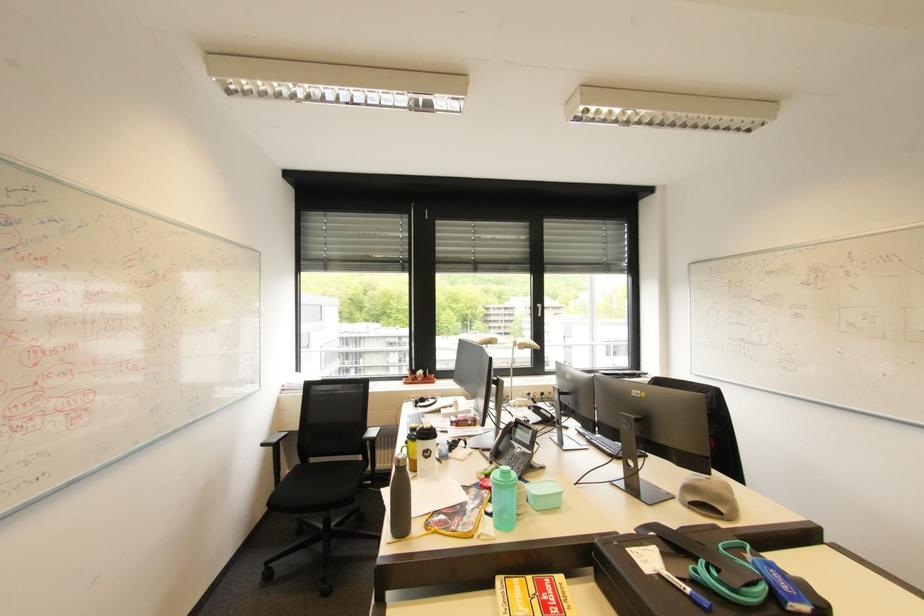
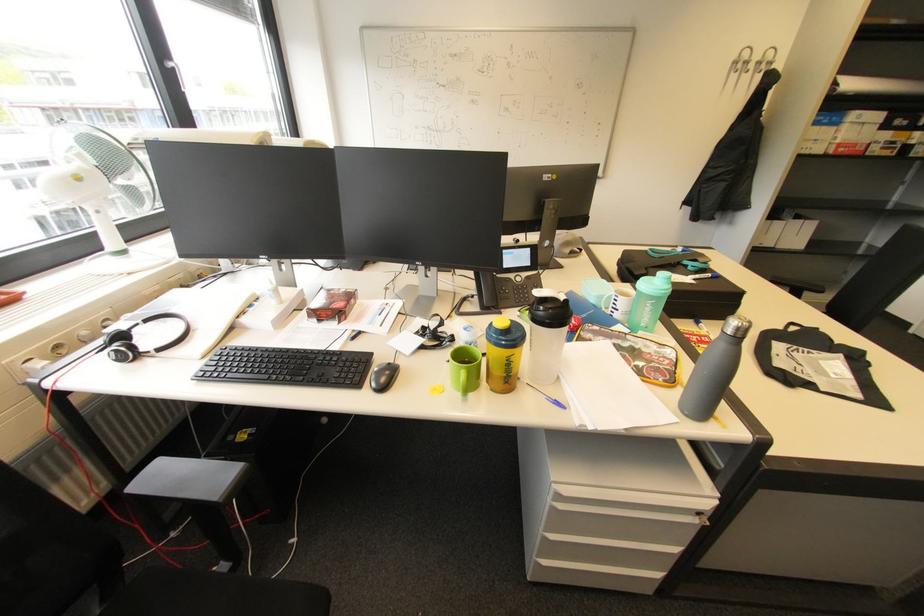
The point at (x=419, y=406) is marked in the first image. Where is the corresponding point in the second image?

(127, 361)